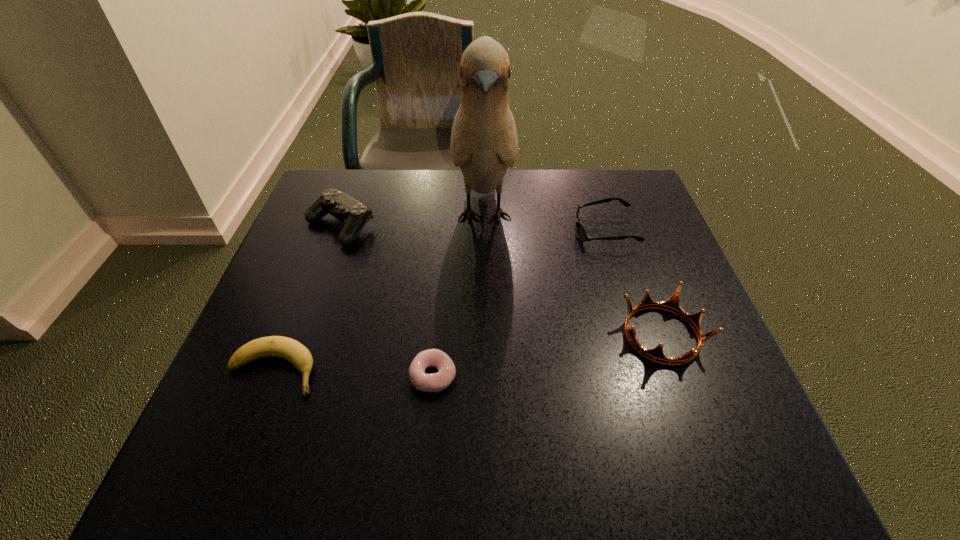
This screenshot has width=960, height=540. I want to click on parakeet, so click(x=484, y=143).

At what (x,y) coordinates should I click in order to perform the action: click on control. Please return your answer as a coordinate pair (x, y). Looking at the image, I should click on (354, 214).

Image resolution: width=960 pixels, height=540 pixels. Find the location of `crown`. crown is located at coordinates (656, 354).

This screenshot has height=540, width=960. Find the location of `the third shortest object`. the third shortest object is located at coordinates (582, 234).

I want to click on banana, so click(297, 354).

Locate an element on the screen. The height and width of the screenshot is (540, 960). doughnut is located at coordinates (435, 382).

The image size is (960, 540). I want to click on blank space located on the face of the tallest object, so click(x=485, y=340).

This screenshot has width=960, height=540. In order to click on free region located on the front of the control in this screenshot , I will do `click(323, 275)`.

This screenshot has width=960, height=540. I want to click on free space located 0.200m on the back of the crown, so click(x=628, y=242).

You are a GUI agent. You are given a task and a screenshot of the screen. Output one action in this format:
    pyautogui.click(x=<x>, y=<y>)
    Task: Click on the vacant space located on the lenses of the sunglasses
    The width and height of the screenshot is (960, 540).
    Given the screenshot: What is the action you would take?
    pyautogui.click(x=473, y=231)